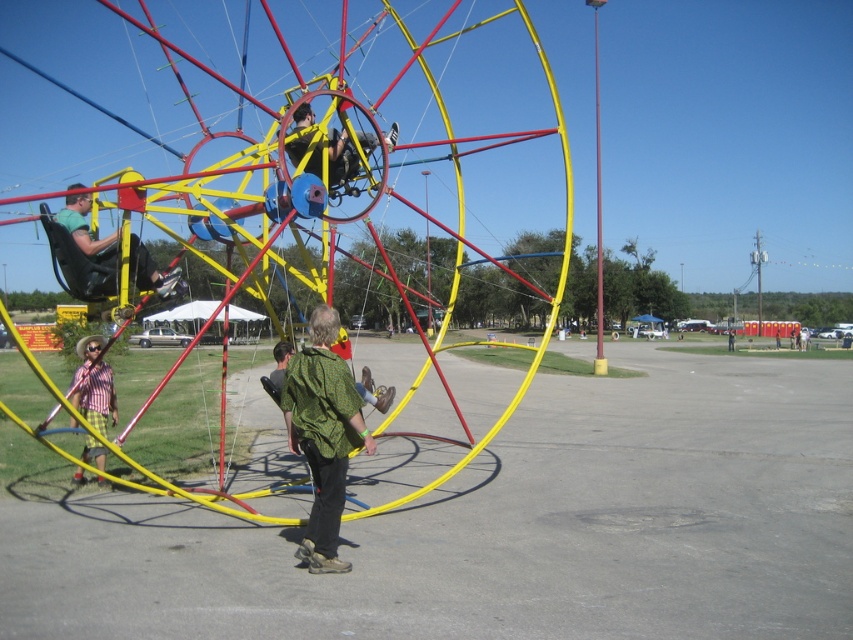
From the picture: You are a photographer positioned at the base of the Ferris wheel structure. You want to capture a photo that includes both the plaid shirt at left and the matte black helmet at upper center. Which object should you adjust your camera angle to focus on first to ensure both are in frame?

You should focus on the plaid shirt at left first since it is positioned to the left of the matte black helmet at upper center, ensuring both will be captured by adjusting the camera angle from left to right.